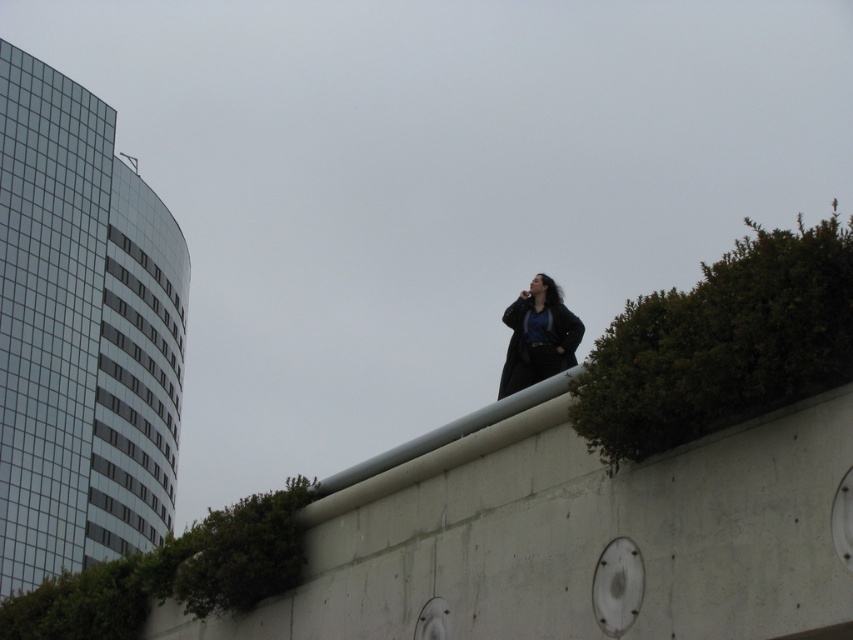
Is green leafy bush at upper right further to camera compared to matte black coat at upper center?

That is False.

Can you confirm if green leafy bush at upper right is wider than matte black coat at upper center?

Yes.

Is point (796, 328) positioned before point (537, 346)?

Yes, point (796, 328) is in front of point (537, 346).

This screenshot has height=640, width=853. Identify the location of green leafy bush at upper right. (721, 342).

Between green leafy plant at lower left and matte black coat at upper center, which one appears on the left side from the viewer's perspective?

green leafy plant at lower left

Is point (250, 525) closer to viewer compared to point (544, 365)?

Yes, point (250, 525) is closer to viewer.

Image resolution: width=853 pixels, height=640 pixels. Find the location of `green leafy plant at lower left`. green leafy plant at lower left is located at coordinates (173, 573).

Can you confirm if green leafy bush at upper right is positioned above green leafy plant at lower left?

Yes.

Based on the photo, is green leafy bush at upper right to the right of green leafy plant at lower left from the viewer's perspective?

Correct, you'll find green leafy bush at upper right to the right of green leafy plant at lower left.

Image resolution: width=853 pixels, height=640 pixels. What do you see at coordinates (721, 342) in the screenshot? I see `green leafy bush at upper right` at bounding box center [721, 342].

Locate an element on the screen. The image size is (853, 640). green leafy bush at upper right is located at coordinates (721, 342).